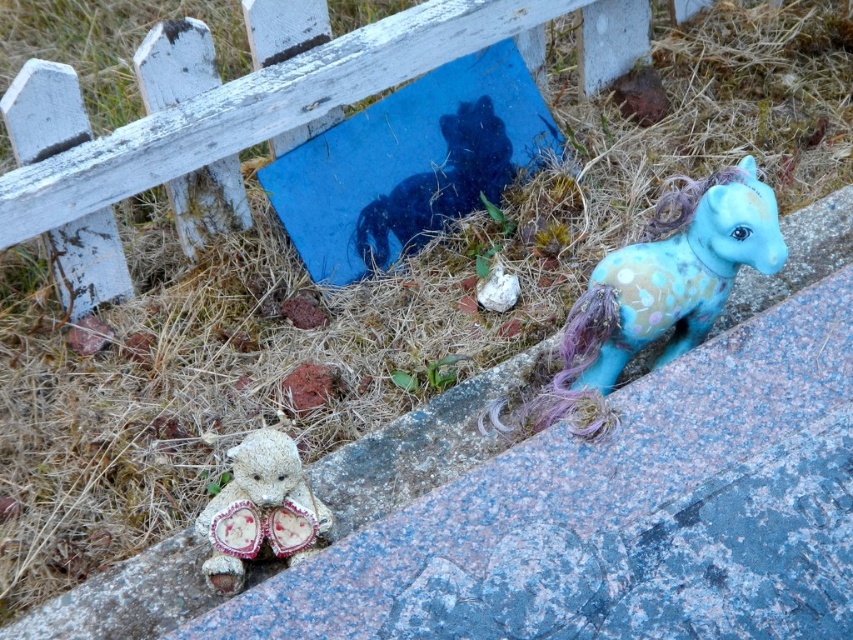
Question: Which point is closer to the camera?

Choices:
 (A) blue felt pony at right
 (B) fuzzy fabric teddy bear at lower left
 (C) white wooden fence at upper left
 (D) blue matte horse at center

Answer: (B)

Question: Does white wooden fence at upper left appear on the right side of blue matte horse at center?

Choices:
 (A) no
 (B) yes

Answer: (A)

Question: Observing the image, what is the correct spatial positioning of white wooden fence at upper left in reference to fuzzy fabric teddy bear at lower left?

Choices:
 (A) below
 (B) above

Answer: (B)

Question: Is blue felt pony at right closer to the viewer compared to blue matte horse at center?

Choices:
 (A) no
 (B) yes

Answer: (B)

Question: Which point appears farthest from the camera in this image?

Choices:
 (A) (407, 228)
 (B) (260, 531)

Answer: (A)

Question: Which point is farther to the camera?

Choices:
 (A) (585, 392)
 (B) (235, 506)
 (C) (91, 304)

Answer: (C)